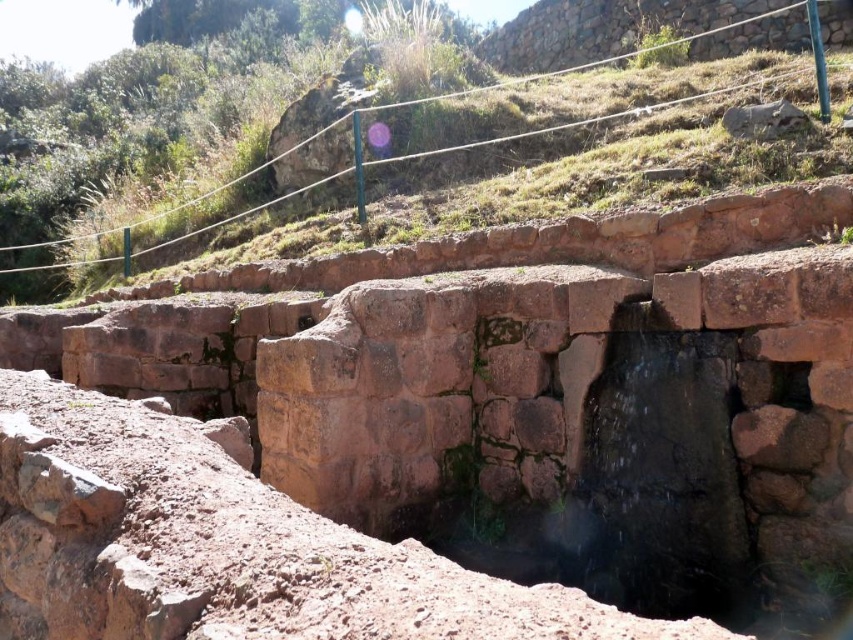
Can you confirm if brown rough stone at center is shorter than brown stone steps at center?

Yes, brown rough stone at center is shorter than brown stone steps at center.

Find the location of a particular element. brown rough stone at center is located at coordinates (432, 428).